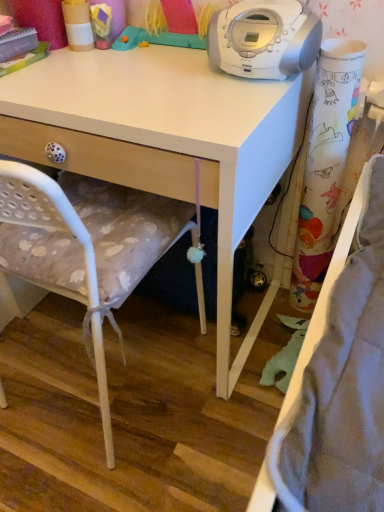
Question: From the image's perspective, is white matte desk at upper center located above colorful paper curtain at right?

Choices:
 (A) yes
 (B) no

Answer: (A)

Question: Does white matte desk at upper center come behind colorful paper curtain at right?

Choices:
 (A) no
 (B) yes

Answer: (A)

Question: Can you confirm if white matte desk at upper center is wider than colorful paper curtain at right?

Choices:
 (A) no
 (B) yes

Answer: (B)

Question: Is white matte desk at upper center turned away from colorful paper curtain at right?

Choices:
 (A) yes
 (B) no

Answer: (B)

Question: Can you confirm if white matte desk at upper center is bigger than colorful paper curtain at right?

Choices:
 (A) yes
 (B) no

Answer: (A)

Question: Does white matte desk at upper center have a lesser width compared to colorful paper curtain at right?

Choices:
 (A) no
 (B) yes

Answer: (A)

Question: From the image's perspective, is white plastic stereo at upper center located beneath white fabric chair at center?

Choices:
 (A) yes
 (B) no

Answer: (B)

Question: Is white plastic stereo at upper center facing away from white fabric chair at center?

Choices:
 (A) no
 (B) yes

Answer: (A)

Question: Is the surface of white plastic stereo at upper center in direct contact with white fabric chair at center?

Choices:
 (A) no
 (B) yes

Answer: (A)

Question: From a real-world perspective, is white plastic stereo at upper center under white fabric chair at center?

Choices:
 (A) yes
 (B) no

Answer: (B)

Question: Can you confirm if white plastic stereo at upper center is shorter than white fabric chair at center?

Choices:
 (A) yes
 (B) no

Answer: (A)

Question: Does white plastic stereo at upper center have a greater width compared to white fabric chair at center?

Choices:
 (A) yes
 (B) no

Answer: (B)

Question: Can you confirm if colorful paper curtain at right is positioned to the right of white matte desk at upper center?

Choices:
 (A) yes
 (B) no

Answer: (A)